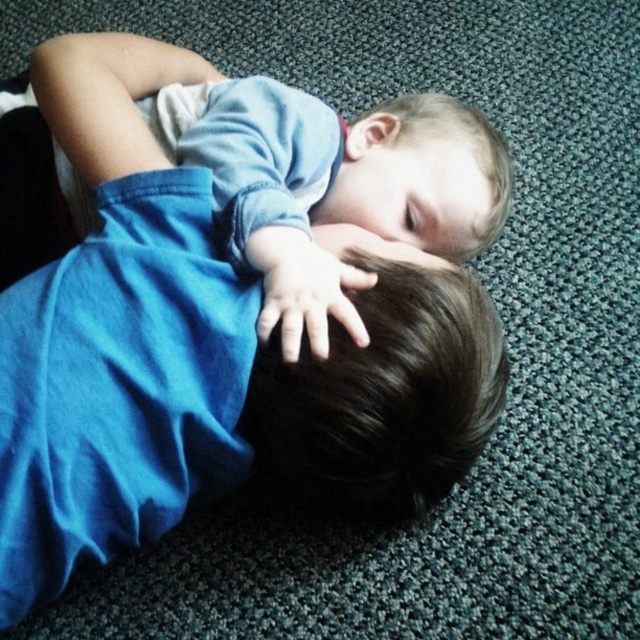
Question: Observing the image, what is the correct spatial positioning of blue denim shirt at upper center in reference to dark brown hair at center?

Choices:
 (A) below
 (B) above

Answer: (B)

Question: Can you confirm if blue denim shirt at upper center is positioned above dark brown hair at center?

Choices:
 (A) yes
 (B) no

Answer: (A)

Question: Considering the relative positions of blue denim shirt at upper center and dark brown hair at center in the image provided, where is blue denim shirt at upper center located with respect to dark brown hair at center?

Choices:
 (A) left
 (B) right

Answer: (A)